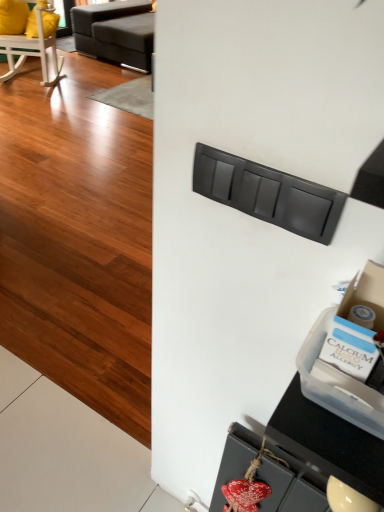
Question: From a real-world perspective, is dark gray fabric studio couch at upper left above or below matte gray drawer at lower center, which ranks as the first drawer in back-to-front order?

Choices:
 (A) above
 (B) below

Answer: (B)

Question: From the image's perspective, is dark gray fabric studio couch at upper left located above or below matte gray drawer at lower center, the 1th drawer when ordered from bottom to top?

Choices:
 (A) above
 (B) below

Answer: (A)

Question: Which is nearer to the matte black drawer at center, which is the 1th drawer from top to bottom?

Choices:
 (A) wooden rocking chair at upper left
 (B) dark gray fabric studio couch at upper left
 (C) matte gray drawer at lower center, which ranks as the first drawer in back-to-front order

Answer: (C)

Question: Which object is the farthest from the matte gray drawer at lower center, which ranks as the first drawer in back-to-front order?

Choices:
 (A) wooden rocking chair at upper left
 (B) matte black drawer at center, which ranks as the second drawer in bottom-to-top order
 (C) dark gray fabric studio couch at upper left

Answer: (C)